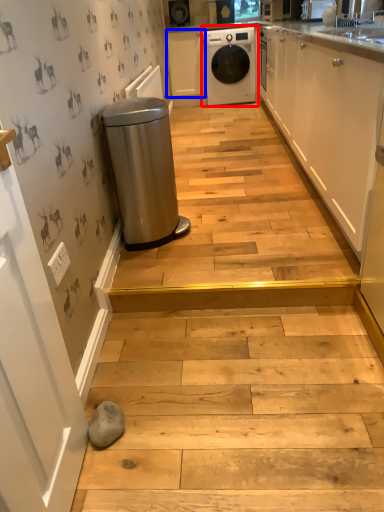
Question: Which point is further to the camera, home appliance (highlighted by a red box) or cabinetry (highlighted by a blue box)?

Choices:
 (A) home appliance
 (B) cabinetry

Answer: (B)